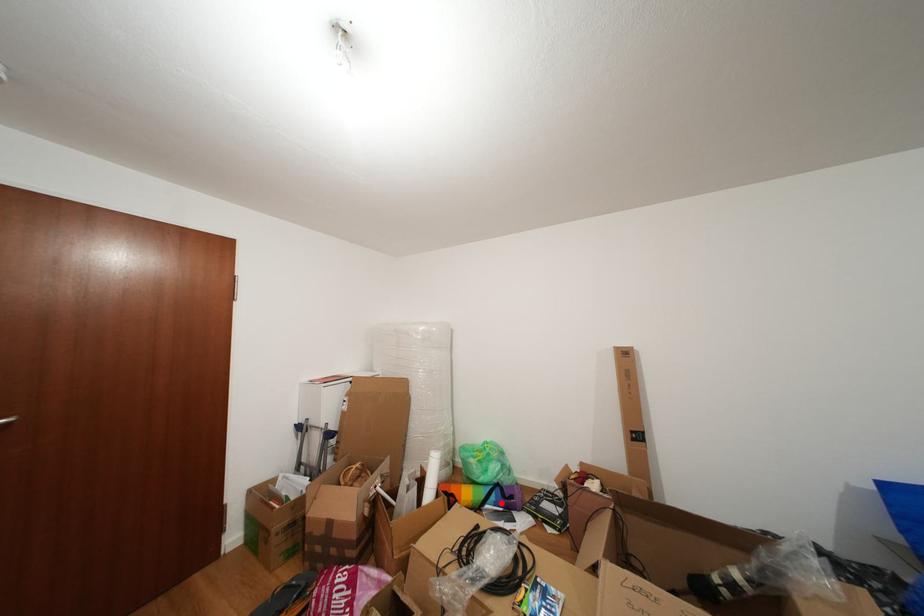
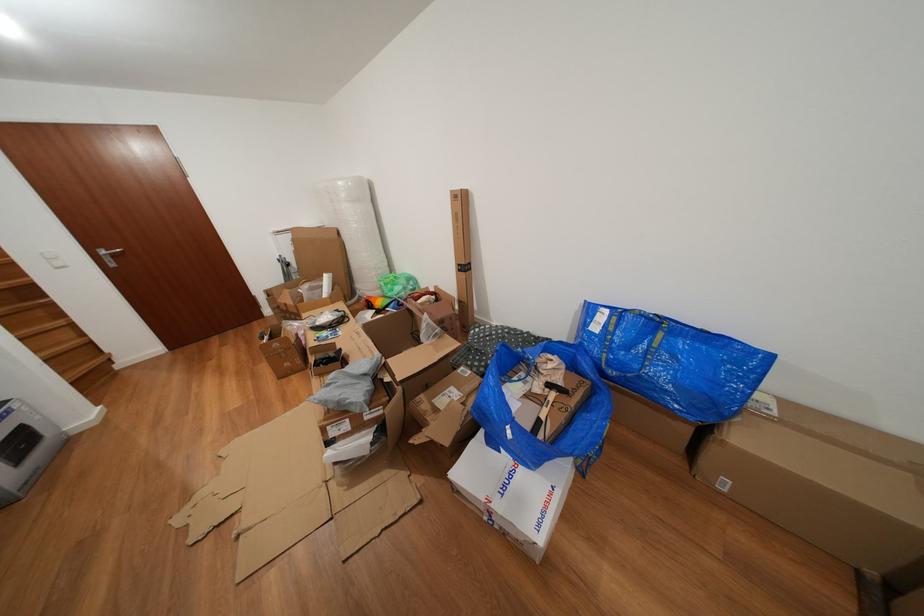
Question: I am providing you with two images of the same scene from different viewpoints. Image1 has a red point marked. In image2, the corresponding 3D location appears at what relative position? Reply with the corresponding letter.

Choices:
 (A) Closer
 (B) Farther

Answer: (B)